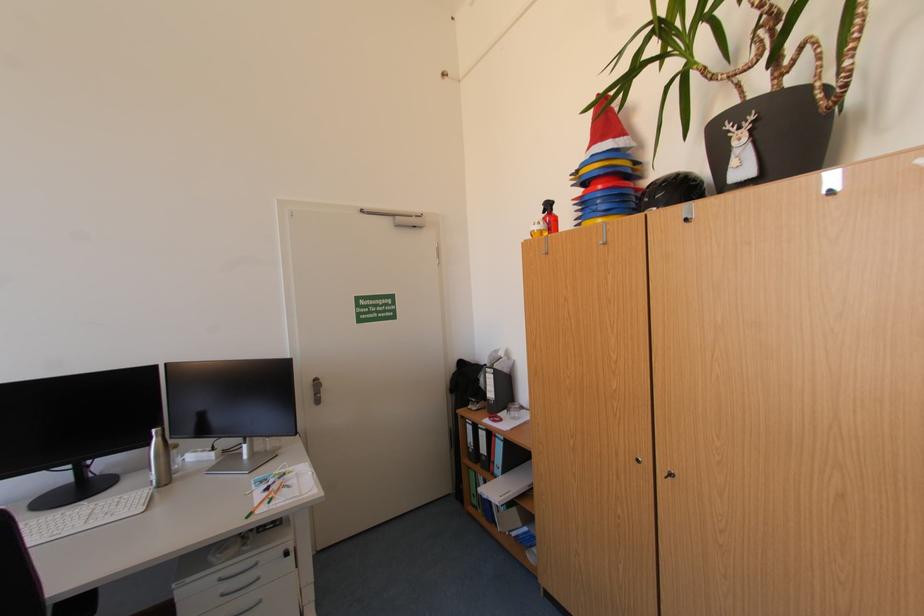
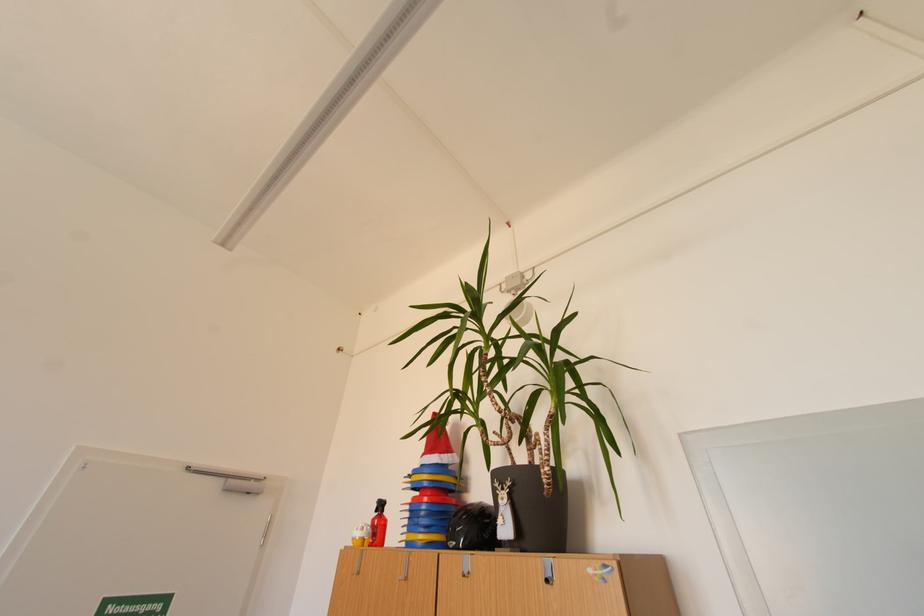
Question: How did the camera likely rotate?

Choices:
 (A) Left
 (B) Right
 (C) Up
 (D) Down

Answer: (C)